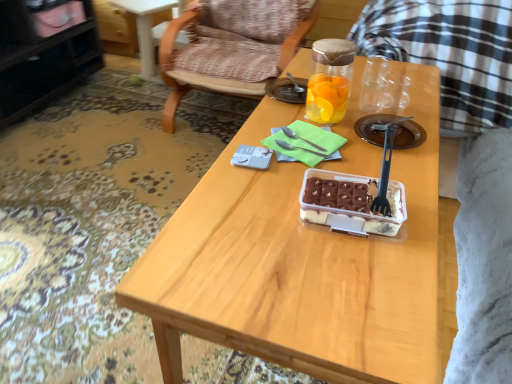
The width and height of the screenshot is (512, 384). I want to click on unoccupied space behind translucent plastic container at center, so click(x=367, y=164).